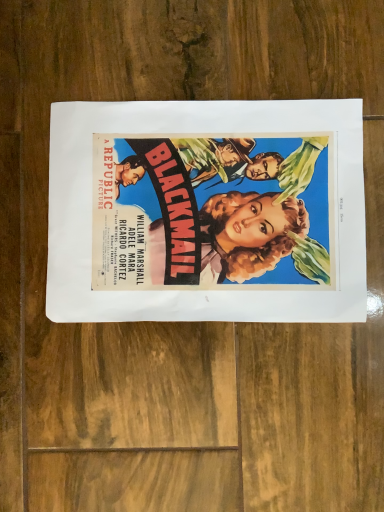
What do you see at coordinates (206, 212) in the screenshot? I see `matte paper poster at center` at bounding box center [206, 212].

The width and height of the screenshot is (384, 512). Identify the location of matte paper poster at center. (206, 212).

What is the approximate height of matte paper poster at center?

matte paper poster at center is 1.50 centimeters tall.

Locate an element on the screen. Image resolution: width=384 pixels, height=512 pixels. matte paper poster at center is located at coordinates (206, 212).